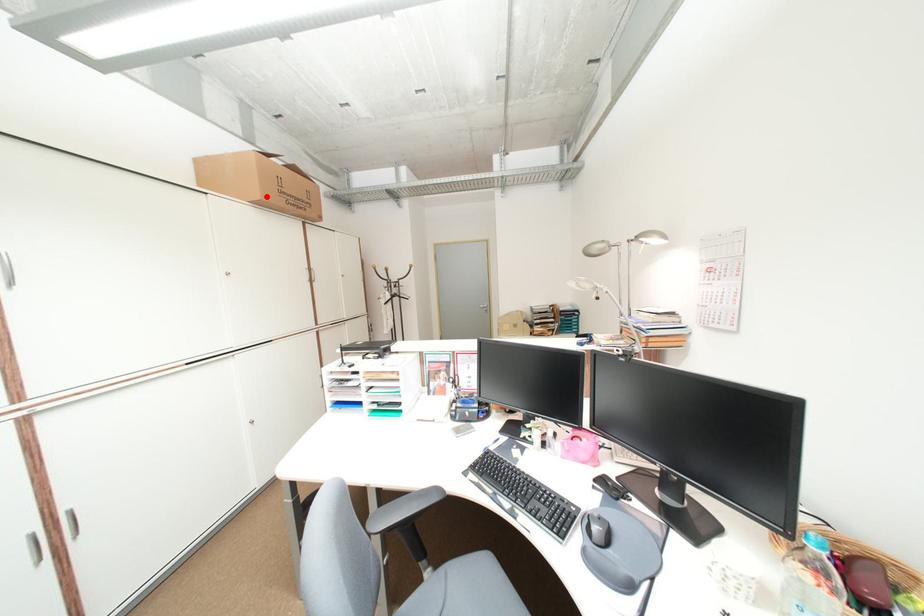
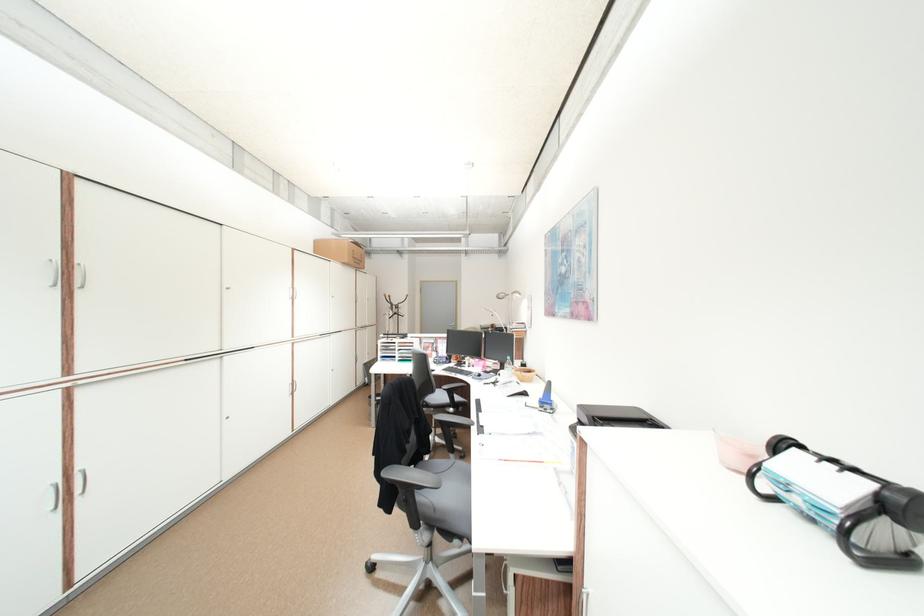
Where in the second image is the point corresponding to the highlighted location from the first image?

(356, 262)